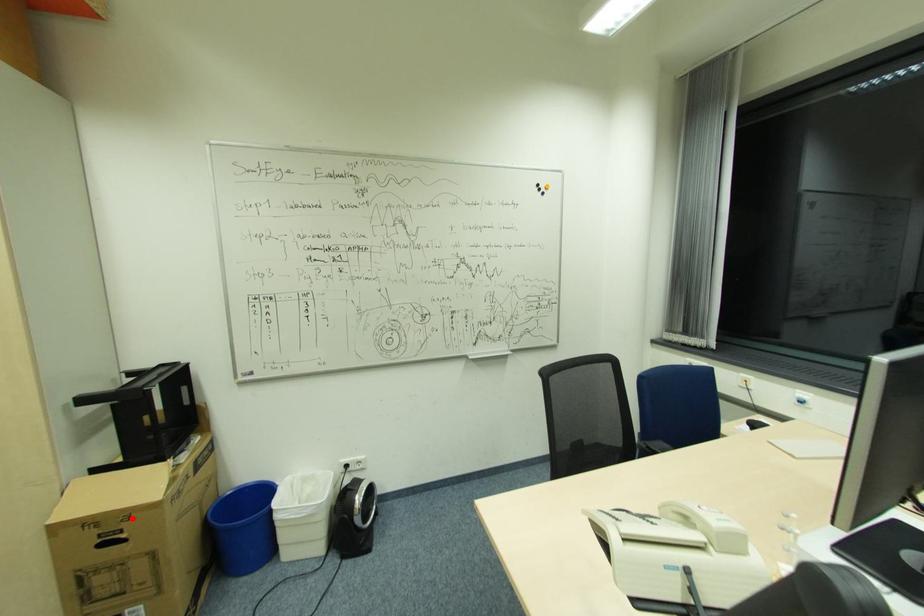
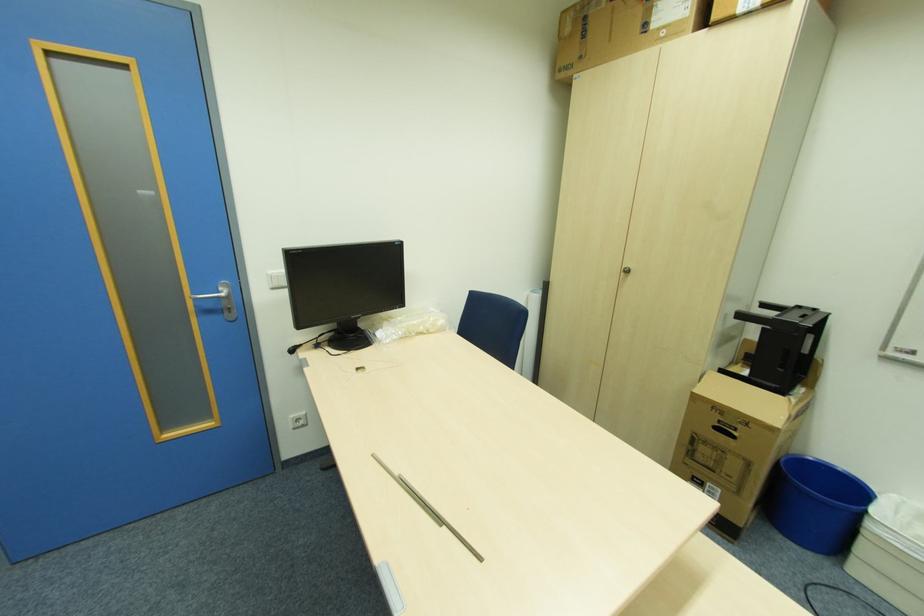
Locate, in the second image, the point that corresponds to the highlighted location in the first image.

(748, 424)